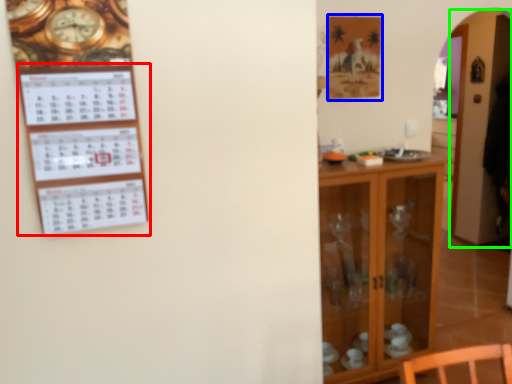
Question: Which object is the farthest from bulletin board (highlighted by a red box)? Choose among these: picture frame (highlighted by a blue box) or glass door (highlighted by a green box).

Choices:
 (A) picture frame
 (B) glass door

Answer: (B)